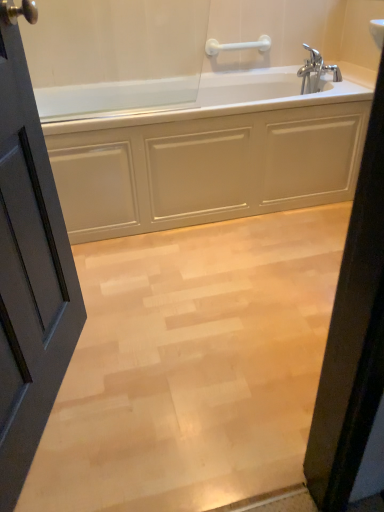
At what (x,y) coordinates should I click in order to perform the action: click on vacant space in white plastic towel bar at upper center (from a real-world perspective). Please return your answer as a coordinate pair (x, y). Looking at the image, I should click on (240, 70).